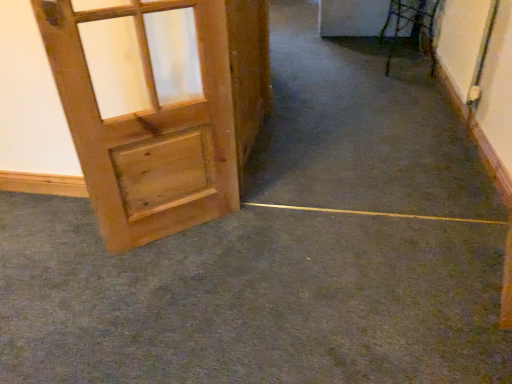
Question: Is green carpet at lower left at the right side of natural wood door at left?

Choices:
 (A) no
 (B) yes

Answer: (B)

Question: Considering the relative positions of green carpet at lower left and natural wood door at left in the image provided, is green carpet at lower left to the left of natural wood door at left from the viewer's perspective?

Choices:
 (A) no
 (B) yes

Answer: (A)

Question: Is green carpet at lower left completely or partially outside of natural wood door at left?

Choices:
 (A) yes
 (B) no

Answer: (A)

Question: Can you confirm if green carpet at lower left is bigger than natural wood door at left?

Choices:
 (A) yes
 (B) no

Answer: (A)

Question: Does green carpet at lower left come in front of natural wood door at left?

Choices:
 (A) no
 (B) yes

Answer: (B)

Question: Is green carpet at lower left not near natural wood door at left?

Choices:
 (A) no
 (B) yes

Answer: (A)

Question: Is natural wood door at left further to camera compared to green carpet at lower left?

Choices:
 (A) yes
 (B) no

Answer: (A)

Question: Can green carpet at lower left be found inside natural wood door at left?

Choices:
 (A) yes
 (B) no

Answer: (B)

Question: Is natural wood door at left taller than green carpet at lower left?

Choices:
 (A) no
 (B) yes

Answer: (B)

Question: Is natural wood door at left far from green carpet at lower left?

Choices:
 (A) yes
 (B) no

Answer: (B)

Question: From the image's perspective, does natural wood door at left appear lower than green carpet at lower left?

Choices:
 (A) yes
 (B) no

Answer: (B)

Question: Can we say natural wood door at left lies outside green carpet at lower left?

Choices:
 (A) yes
 (B) no

Answer: (A)

Question: Considering the positions of point (260, 364) and point (158, 205), is point (260, 364) closer or farther from the camera than point (158, 205)?

Choices:
 (A) farther
 (B) closer

Answer: (B)